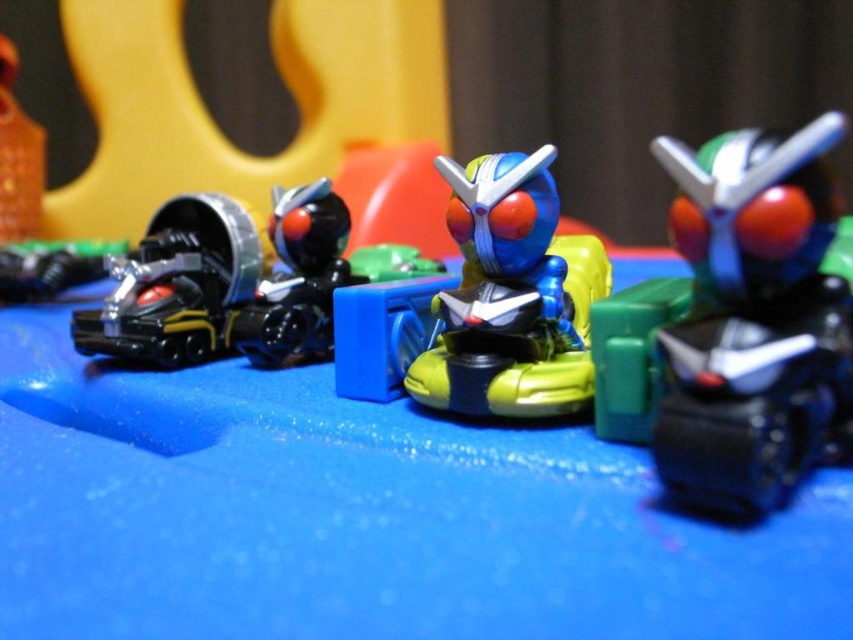
You are setting up a display for a Kamen Rider toy collection. You have a shiny plastic robot at center and a black plastic toy at left. Which toy is taller?

The shiny plastic robot at center is taller than the black plastic toy at left.

You are a collector of Kamen Rider toys and want to place both the green matte robot at right and the shiny plastic robot at center on a shelf. Since the shelf has limited space, you need to know which robot takes up less space. Which one should you choose?

The green matte robot at right is smaller than the shiny plastic robot at center, so you should choose the green matte robot at right to save space.